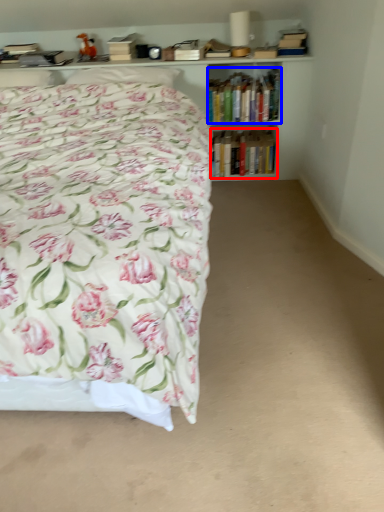
Question: Which of the following is the farthest to the observer, book (highlighted by a red box) or book (highlighted by a blue box)?

Choices:
 (A) book
 (B) book

Answer: (A)